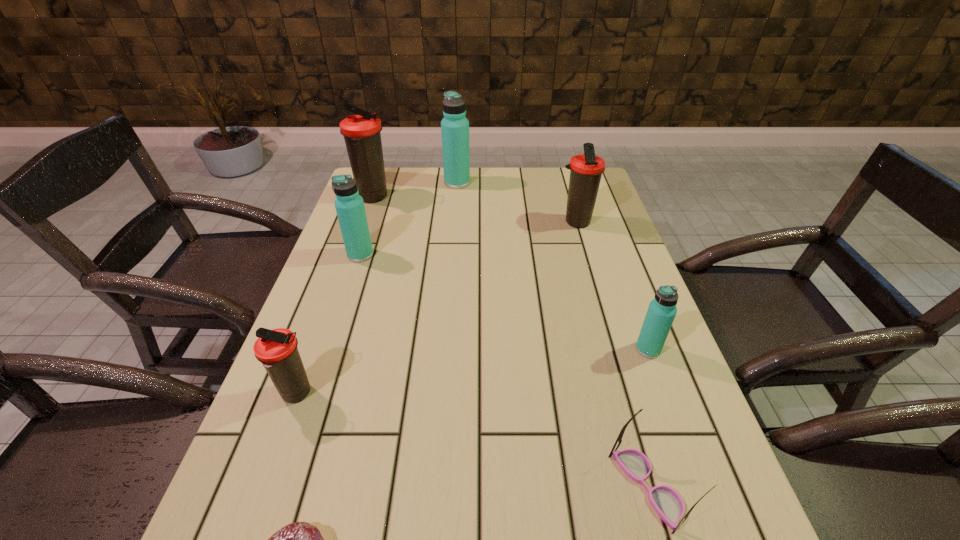
Where is `the biggest brown thermos bottle`? the biggest brown thermos bottle is located at coordinates (362, 133).

This screenshot has width=960, height=540. In order to click on the biggest aqua thermos bottle in this screenshot , I will do `click(454, 126)`.

I want to click on the fifth object from left to right, so click(454, 126).

Locate an element on the screen. This screenshot has height=540, width=960. the second farthest brown thermos bottle is located at coordinates (586, 169).

The width and height of the screenshot is (960, 540). Find the location of `the sixth nearest object`. the sixth nearest object is located at coordinates (586, 169).

Locate an element on the screen. the fourth farthest thermos bottle is located at coordinates (350, 209).

You are a GUI agent. You are given a task and a screenshot of the screen. Output one action in this format:
    pyautogui.click(x=<x>, y=<y>)
    Task: Click on the leftmost aqua thermos bottle
    Image resolution: width=960 pixels, height=540 pixels.
    Given the screenshot: What is the action you would take?
    pyautogui.click(x=350, y=209)

Where is `the smallest aqua thermos bottle`? Image resolution: width=960 pixels, height=540 pixels. the smallest aqua thermos bottle is located at coordinates (662, 310).

Find the location of `the nearest aqua thermos bottle`. the nearest aqua thermos bottle is located at coordinates (662, 310).

Identify the location of the third nearest object. The height and width of the screenshot is (540, 960). (276, 349).